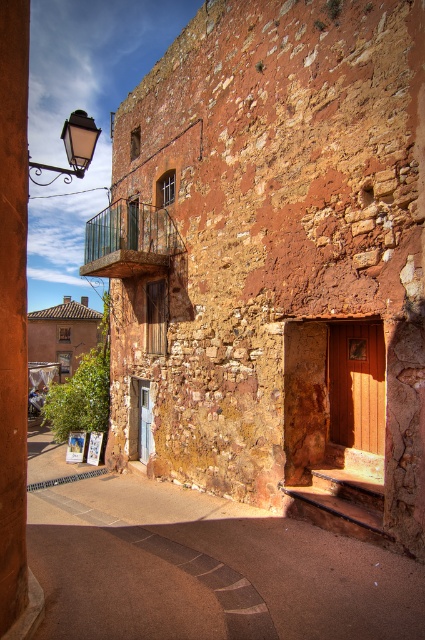
Question: Does brown concrete alley at center have a larger size compared to brown stone pillar at left?

Choices:
 (A) yes
 (B) no

Answer: (A)

Question: Among these objects, which one is farthest from the camera?

Choices:
 (A) green glass balcony at upper left
 (B) brown stone pillar at left

Answer: (A)

Question: Which object appears closest to the camera in this image?

Choices:
 (A) matte black streetlamp at upper left
 (B) brown concrete alley at center

Answer: (B)

Question: Is green glass balcony at upper left to the left of matte black streetlamp at upper left from the viewer's perspective?

Choices:
 (A) no
 (B) yes

Answer: (A)

Question: Which point is closer to the camera?

Choices:
 (A) (93, 131)
 (B) (161, 262)
 (C) (28, 625)
 (D) (39, 513)

Answer: (C)

Question: From the image, what is the correct spatial relationship of brown concrete alley at center in relation to matte black streetlamp at upper left?

Choices:
 (A) right
 (B) left

Answer: (A)